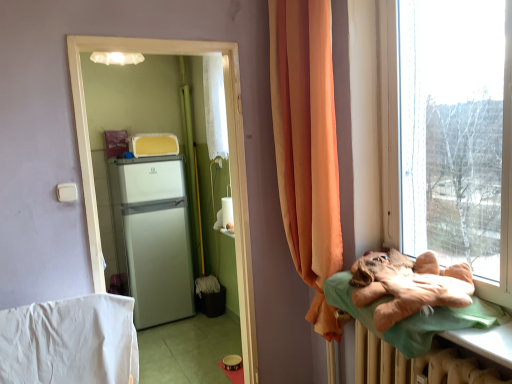
Question: Does white matte refrigerator at left contain white cotton blanket at lower left?

Choices:
 (A) yes
 (B) no

Answer: (B)

Question: Is the position of white matte refrigerator at left less distant than that of white cotton blanket at lower left?

Choices:
 (A) yes
 (B) no

Answer: (B)

Question: Considering the relative sizes of white matte refrigerator at left and white cotton blanket at lower left in the image provided, is white matte refrigerator at left shorter than white cotton blanket at lower left?

Choices:
 (A) no
 (B) yes

Answer: (A)

Question: Does white matte refrigerator at left have a greater width compared to white cotton blanket at lower left?

Choices:
 (A) yes
 (B) no

Answer: (B)

Question: Is white matte refrigerator at left smaller than white cotton blanket at lower left?

Choices:
 (A) no
 (B) yes

Answer: (A)

Question: From a real-world perspective, relative to white matte refrigerator at left, is white glossy refrigerator at center vertically above or below?

Choices:
 (A) below
 (B) above

Answer: (B)

Question: Relative to white matte refrigerator at left, is white glossy refrigerator at center in front or behind?

Choices:
 (A) behind
 (B) front

Answer: (B)

Question: Is white glossy refrigerator at center inside or outside of white matte refrigerator at left?

Choices:
 (A) outside
 (B) inside

Answer: (A)

Question: Does point tap(74, 43) appear closer or farther from the camera than point tap(138, 243)?

Choices:
 (A) farther
 (B) closer

Answer: (B)

Question: In terms of size, does brown plush bear at right appear bigger or smaller than white matte refrigerator at left?

Choices:
 (A) small
 (B) big

Answer: (A)

Question: Is brown plush bear at right situated inside white matte refrigerator at left or outside?

Choices:
 (A) outside
 (B) inside

Answer: (A)

Question: Is point (407, 349) closer or farther from the camera than point (148, 258)?

Choices:
 (A) closer
 (B) farther

Answer: (A)

Question: Is brown plush bear at right wider or thinner than white matte refrigerator at left?

Choices:
 (A) wide
 (B) thin

Answer: (A)

Question: Based on their sizes in the image, would you say white matte refrigerator at left is bigger or smaller than white glossy refrigerator at center?

Choices:
 (A) big
 (B) small

Answer: (A)

Question: Would you say white matte refrigerator at left is inside or outside white glossy refrigerator at center?

Choices:
 (A) outside
 (B) inside

Answer: (A)